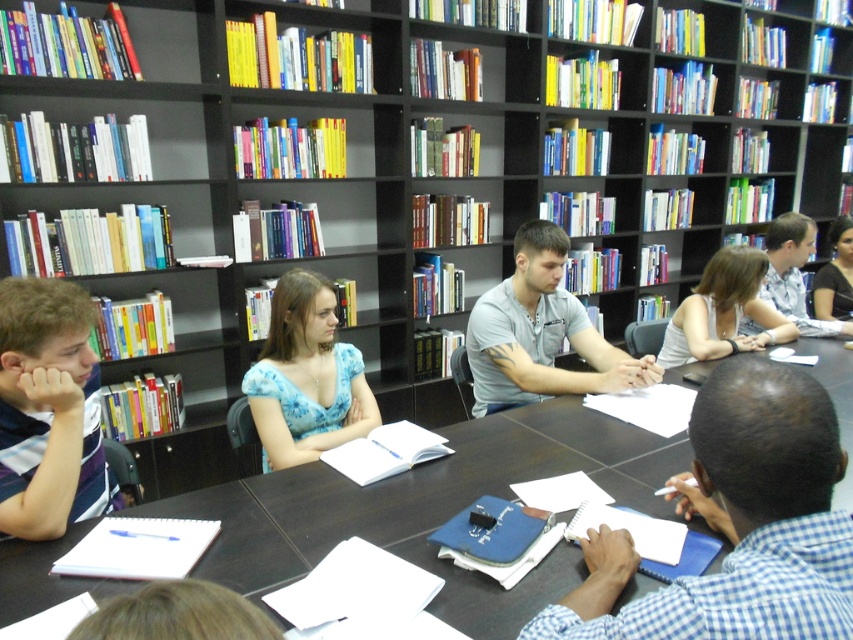
Question: Is blue checkered shirt at center above blue floral dress at center?

Choices:
 (A) no
 (B) yes

Answer: (A)

Question: In this image, where is blue checkered shirt at center located relative to light brown hair at upper right?

Choices:
 (A) below
 (B) above

Answer: (A)

Question: Which point is farther from the camera taking this photo?

Choices:
 (A) (846, 248)
 (B) (15, 396)

Answer: (A)

Question: Among these points, which one is farthest from the camera?

Choices:
 (A) (717, 621)
 (B) (555, 368)
 (C) (720, 346)
 (D) (274, 492)

Answer: (B)

Question: Among these objects, which one is nearest to the camera?

Choices:
 (A) striped shirt at left
 (B) dark wood table at center
 (C) blue floral dress at center

Answer: (B)

Question: Is striped shirt at left wider than dark blue dress at center?

Choices:
 (A) yes
 (B) no

Answer: (B)